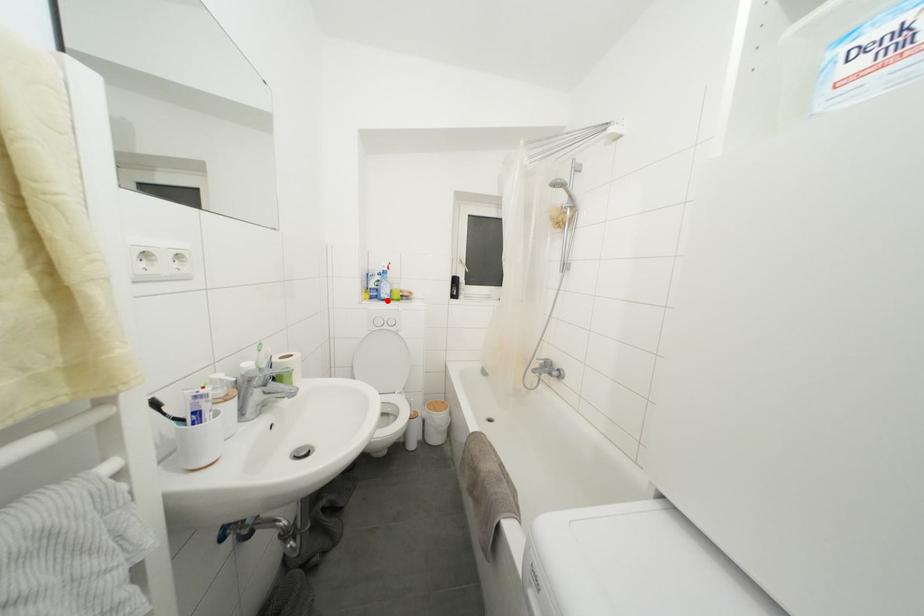
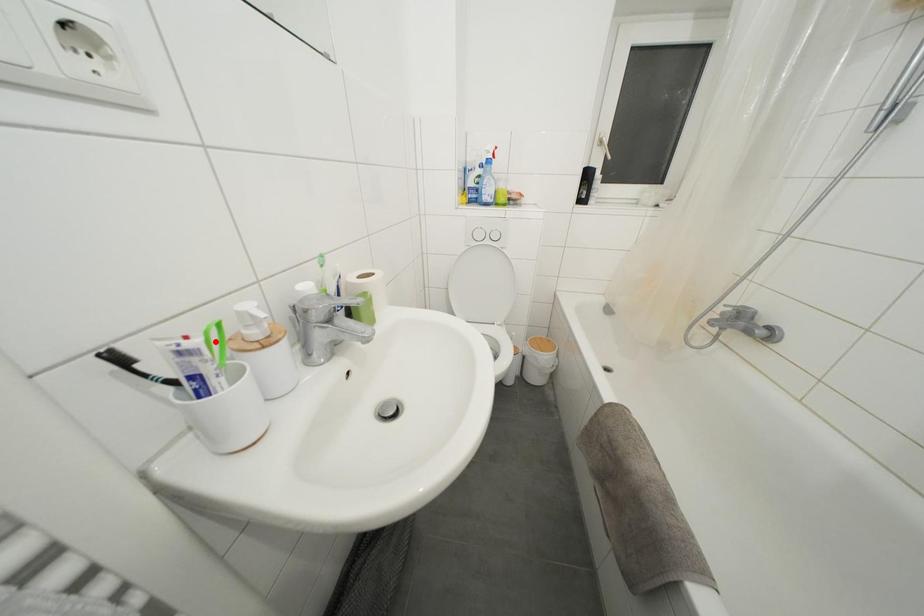
I am providing you with two images of the same scene from different viewpoints. A red point is marked on the first image and another point is marked on the second image. Is the marked point in image1 the same physical position as the marked point in image2?

No